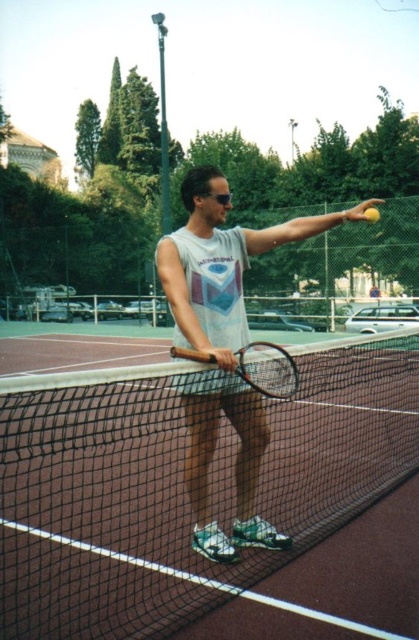
Can you confirm if white cotton tank top at center is taller than matte black tennis racket at center?

Yes, white cotton tank top at center is taller than matte black tennis racket at center.

Based on the photo, does white cotton tank top at center have a greater width compared to matte black tennis racket at center?

Correct, the width of white cotton tank top at center exceeds that of matte black tennis racket at center.

Find the location of a particular element. This screenshot has height=640, width=419. white cotton tank top at center is located at coordinates (222, 346).

Is black mesh net at center behind white cotton tank top at center?

Yes, it is behind white cotton tank top at center.

Who is shorter, black mesh net at center or white cotton tank top at center?

Standing shorter between the two is black mesh net at center.

Describe the element at coordinates (181, 486) in the screenshot. I see `black mesh net at center` at that location.

Where is `black mesh net at center`? This screenshot has width=419, height=640. black mesh net at center is located at coordinates (181, 486).

From the picture: Can you confirm if black mesh net at center is taller than matte black tennis racket at center?

No.

Who is more distant from viewer, (67, 387) or (175, 353)?

Positioned behind is point (175, 353).

Find the location of a particular element. The width and height of the screenshot is (419, 640). black mesh net at center is located at coordinates (181, 486).